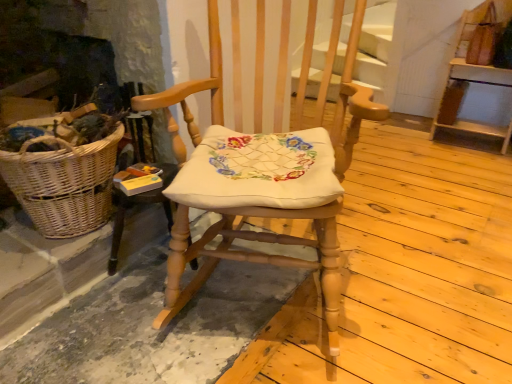
Question: Can you confirm if wooden shelf at upper right is bigger than wooden rocking chair at center?

Choices:
 (A) no
 (B) yes

Answer: (A)

Question: Is wooden shelf at upper right aimed at wooden rocking chair at center?

Choices:
 (A) yes
 (B) no

Answer: (A)

Question: Does wooden shelf at upper right appear on the right side of wooden rocking chair at center?

Choices:
 (A) no
 (B) yes

Answer: (B)

Question: From the image's perspective, is wooden shelf at upper right located above wooden rocking chair at center?

Choices:
 (A) no
 (B) yes

Answer: (B)

Question: Is wooden shelf at upper right thinner than wooden rocking chair at center?

Choices:
 (A) yes
 (B) no

Answer: (A)

Question: Considering the relative positions of woven wicker picnic basket at left and wooden rocking chair at center in the image provided, is woven wicker picnic basket at left to the left or to the right of wooden rocking chair at center?

Choices:
 (A) right
 (B) left

Answer: (B)

Question: Is woven wicker picnic basket at left taller or shorter than wooden rocking chair at center?

Choices:
 (A) short
 (B) tall

Answer: (A)

Question: Is woven wicker picnic basket at left situated inside wooden rocking chair at center or outside?

Choices:
 (A) outside
 (B) inside

Answer: (A)

Question: From the image's perspective, is woven wicker picnic basket at left positioned above or below wooden rocking chair at center?

Choices:
 (A) below
 (B) above

Answer: (A)

Question: Considering the positions of wooden shelf at upper right and wooden rocking chair at center in the image, is wooden shelf at upper right bigger or smaller than wooden rocking chair at center?

Choices:
 (A) big
 (B) small

Answer: (B)

Question: From the image's perspective, is wooden shelf at upper right positioned above or below wooden rocking chair at center?

Choices:
 (A) above
 (B) below

Answer: (A)

Question: Considering their positions, is wooden shelf at upper right located in front of or behind wooden rocking chair at center?

Choices:
 (A) front
 (B) behind

Answer: (B)

Question: Is wooden shelf at upper right inside or outside of wooden rocking chair at center?

Choices:
 (A) inside
 (B) outside

Answer: (B)

Question: Would you say wooden rocking chair at center is to the left or to the right of woven wicker picnic basket at left in the picture?

Choices:
 (A) right
 (B) left

Answer: (A)

Question: Is point (194, 248) closer or farther from the camera than point (72, 218)?

Choices:
 (A) farther
 (B) closer

Answer: (B)